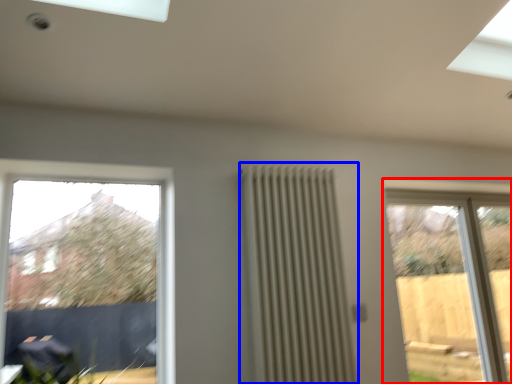
Question: Which object is closer to the camera taking this photo, window (highlighted by a red box) or radiator (highlighted by a blue box)?

Choices:
 (A) window
 (B) radiator

Answer: (B)